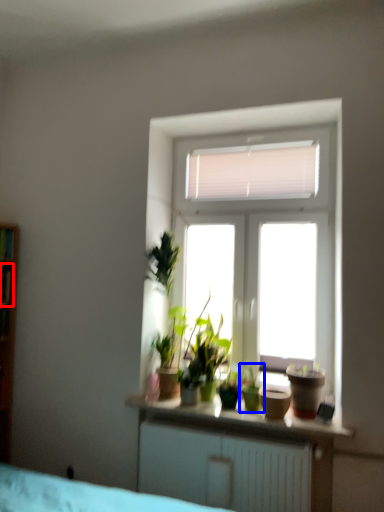
Question: Which object is further to the camera taking this photo, window (highlighted by a red box) or houseplant (highlighted by a blue box)?

Choices:
 (A) window
 (B) houseplant

Answer: (A)